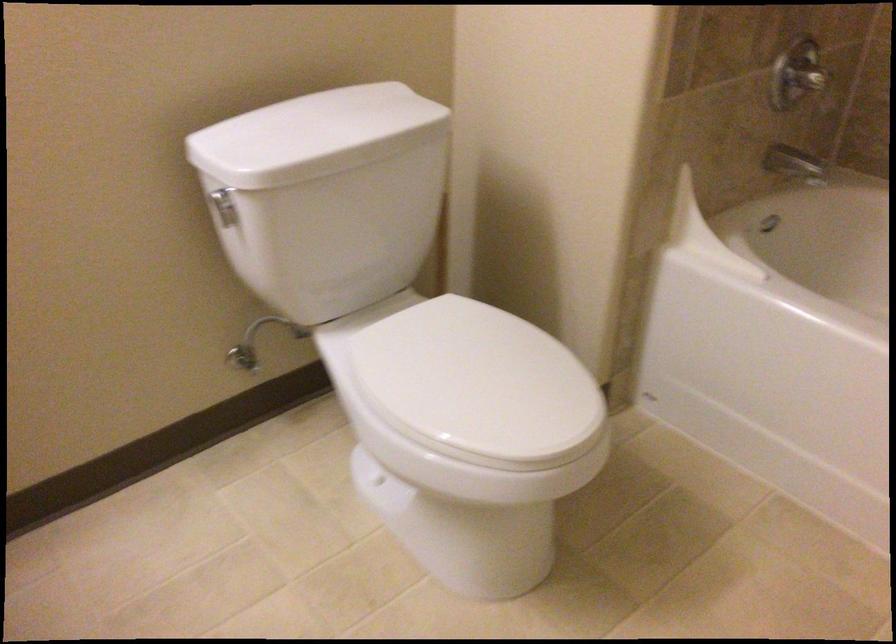
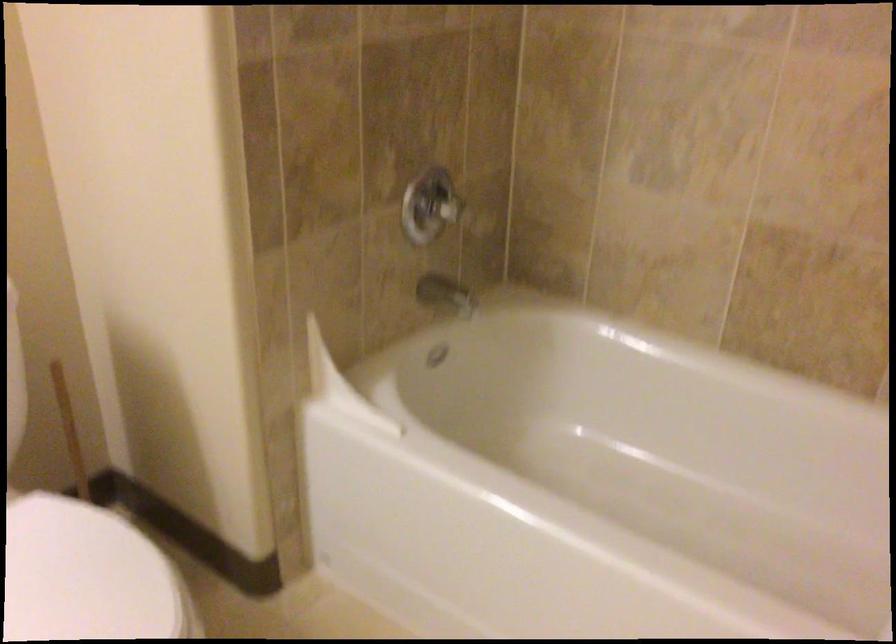
Question: Based on the continuous images, in which direction is the camera rotating? Reply with the corresponding letter.

Choices:
 (A) Left
 (B) Right
 (C) Up
 (D) Down

Answer: (B)